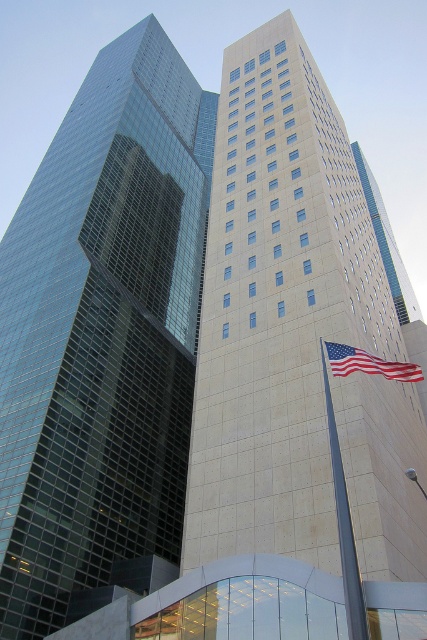
Based on the photo, you are a drone operator tasked with flying a drone between the glassy reflective skyscraper at left and the american flag at right. The drone has a maximum flight distance of 250 feet. Can the drone safely fly between them without exceeding its range?

The glassy reflective skyscraper at left and the american flag at right are 270.74 feet apart from each other. Since the drone can only fly up to 250 feet, it cannot safely fly between them without exceeding its range.

You are standing in the middle of the city square between the glassy reflective skyscraper at left and the white stone building at center. You want to take a photo that captures both buildings in the frame. Which building should you move towards to include both in your camera view?

You should move towards the white stone building at center because the glassy reflective skyscraper at left is closer to the viewer, so moving towards the farther building will help balance their positions in the frame.

You are a city planner evaluating the skyline of this urban area. You need to determine if the white stone building at center will block sunlight to the american flag at right. Based on their heights, can you conclude this?

The white stone building at center is much taller than the american flag at right, so it could potentially block sunlight depending on their positions. However, without knowing the exact distance and angle between them, we cannot definitively conclude if the sunlight is blocked.